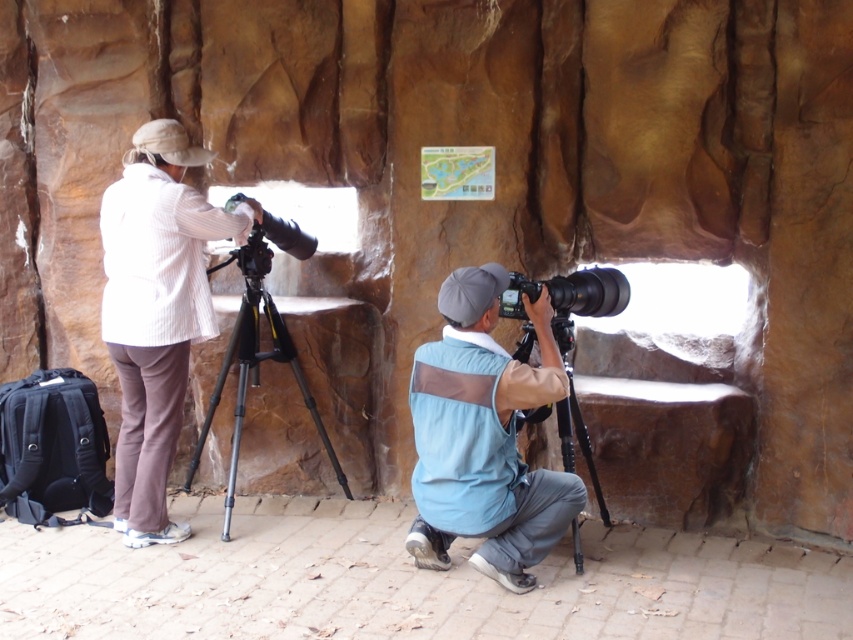
Between point (238, 417) and point (599, 268), which one is positioned behind?

Point (238, 417)

This screenshot has height=640, width=853. I want to click on black metal tripod at center, so click(x=254, y=362).

Does white textured jacket at upper left appear on the right side of black metal tripod at lower center?

No, white textured jacket at upper left is not to the right of black metal tripod at lower center.

Can you confirm if white textured jacket at upper left is smaller than black metal tripod at lower center?

Actually, white textured jacket at upper left might be larger than black metal tripod at lower center.

Is point (140, 196) positioned in front of point (521, 362)?

No, (140, 196) is further to viewer.

Where is `white textured jacket at upper left`? Image resolution: width=853 pixels, height=640 pixels. white textured jacket at upper left is located at coordinates (155, 310).

Which is more to the left, white textured jacket at upper left or black metal tripod at center?

white textured jacket at upper left

You are a GUI agent. You are given a task and a screenshot of the screen. Output one action in this format:
    pyautogui.click(x=<x>, y=<y>)
    Task: Click on the white textured jacket at upper left
    
    Given the screenshot: What is the action you would take?
    pyautogui.click(x=155, y=310)

Where is `white textured jacket at upper left`? Image resolution: width=853 pixels, height=640 pixels. white textured jacket at upper left is located at coordinates click(155, 310).